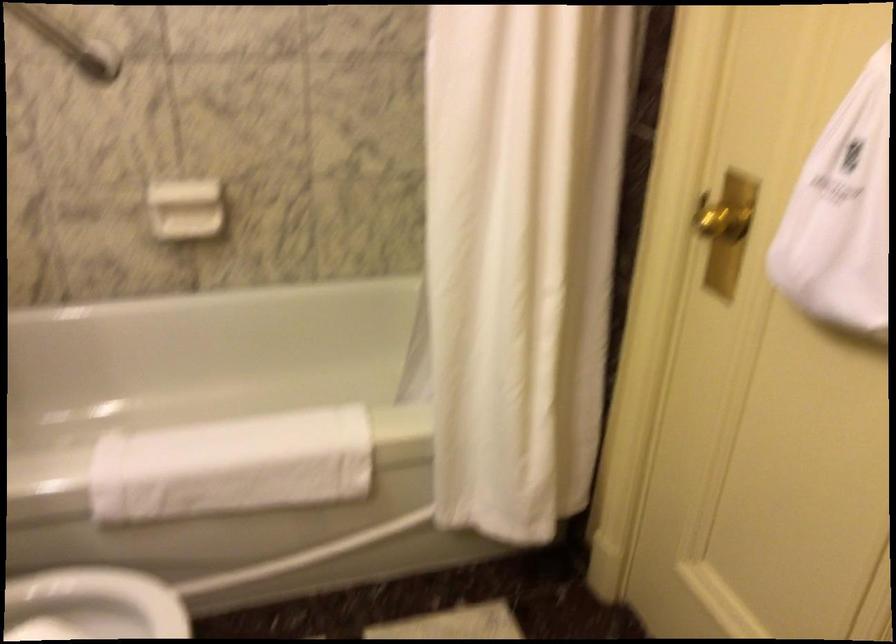
Locate an element on the screen. The width and height of the screenshot is (896, 644). brass door knob is located at coordinates (722, 222).